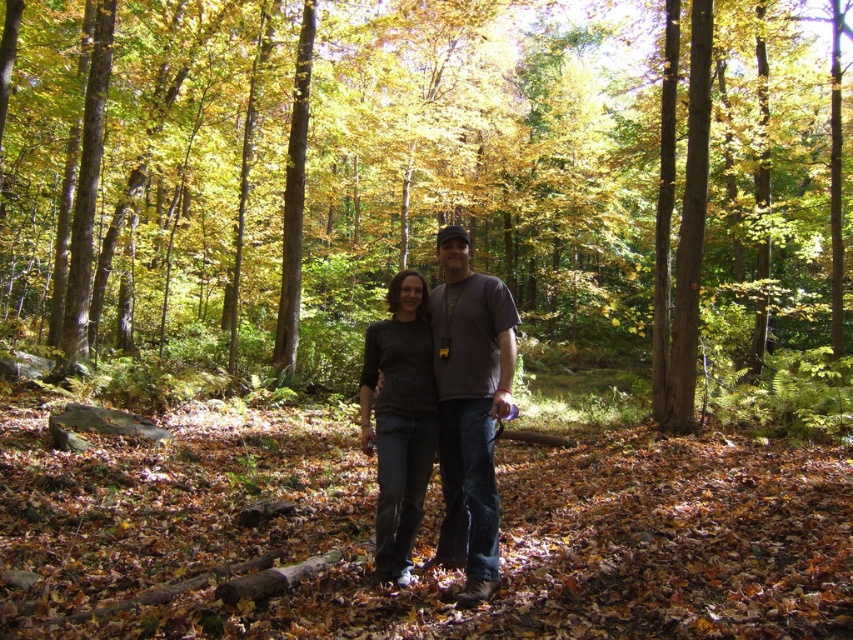
Does dark gray sweater at center appear on the right side of knit sweater at center?

Indeed, dark gray sweater at center is positioned on the right side of knit sweater at center.

How much distance is there between dark gray sweater at center and knit sweater at center?

The distance of dark gray sweater at center from knit sweater at center is 27.69 inches.

Locate an element on the screen. dark gray sweater at center is located at coordinates (469, 410).

Image resolution: width=853 pixels, height=640 pixels. Find the location of `dark gray sweater at center`. dark gray sweater at center is located at coordinates (469, 410).

Can you confirm if brown wood tree at center is taller than dark gray sweater at center?

Yes, brown wood tree at center is taller than dark gray sweater at center.

Is brown wood tree at center smaller than dark gray sweater at center?

Actually, brown wood tree at center might be larger than dark gray sweater at center.

Who is more forward, (x=520, y=3) or (x=486, y=348)?

Point (x=486, y=348)

The height and width of the screenshot is (640, 853). I want to click on brown wood tree at center, so click(x=424, y=179).

Consider the image. Is brown wood tree at center bigger than knit sweater at center?

Yes.

Is brown wood tree at center to the left of knit sweater at center from the viewer's perspective?

In fact, brown wood tree at center is to the right of knit sweater at center.

Does point (96, 148) come closer to viewer compared to point (376, 508)?

That is False.

Locate an element on the screen. The width and height of the screenshot is (853, 640). brown wood tree at center is located at coordinates (424, 179).